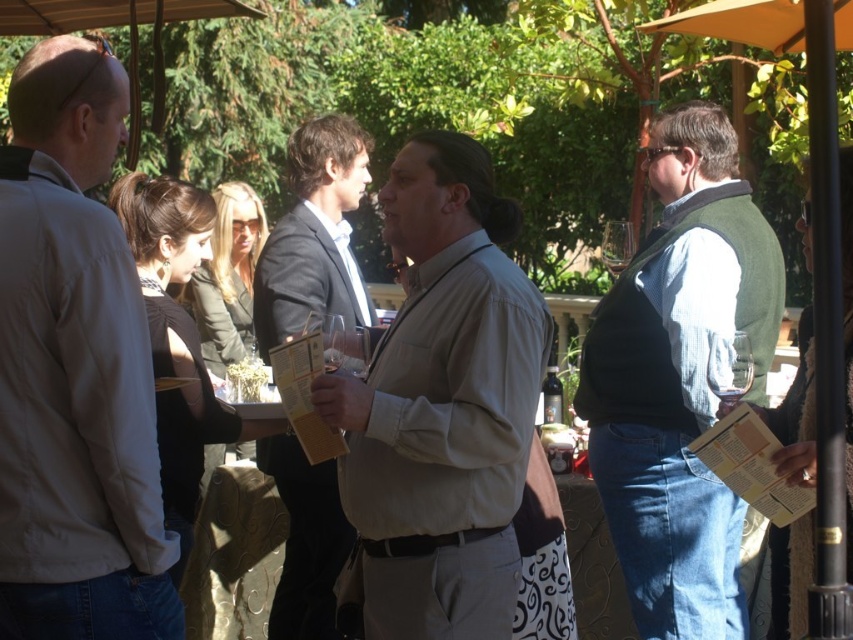
Is light beige shirt at left taller than denim vest at right?

Incorrect, light beige shirt at left's height is not larger of denim vest at right's.

Who is positioned more to the right, light beige shirt at left or denim vest at right?

denim vest at right

Is point (22, 365) positioned before point (657, 595)?

Yes, it is in front of point (657, 595).

The width and height of the screenshot is (853, 640). I want to click on light beige shirt at left, so click(74, 371).

Does point (506, 288) come farther from viewer compared to point (776, 320)?

No, it is in front of (776, 320).

Is light beige shirt at center bigger than denim vest at right?

Actually, light beige shirt at center might be smaller than denim vest at right.

Which is in front, point (515, 454) or point (686, 582)?

Point (515, 454)

The image size is (853, 640). I want to click on light beige shirt at center, so click(442, 404).

Can you confirm if denim vest at right is positioned to the right of dark brown suit at center?

Yes, denim vest at right is to the right of dark brown suit at center.

Does denim vest at right have a larger size compared to dark brown suit at center?

Yes.

Which is in front, point (648, 579) or point (328, 490)?

Point (648, 579)

Where is `denim vest at right`? The image size is (853, 640). denim vest at right is located at coordinates (679, 378).